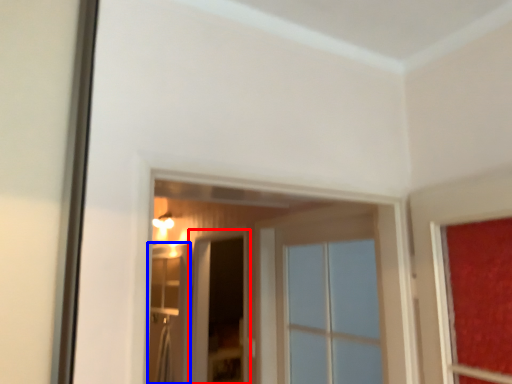
Question: Which of the following is the farthest to the observer, screen door (highlighted by a red box) or screen door (highlighted by a blue box)?

Choices:
 (A) screen door
 (B) screen door

Answer: (B)